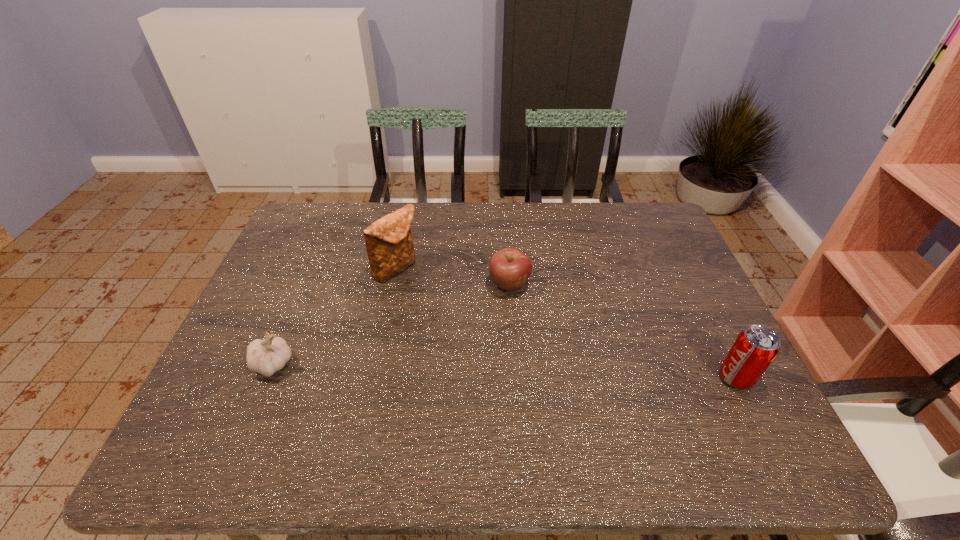
Locate an element on the screen. blank space located 0.220m on the side of the shortest object with the unique marking is located at coordinates (540, 362).

At what (x,y) coordinates should I click in order to perform the action: click on vacant space located 0.130m on the side of the shortest object with the unique marking. Please return your answer as a coordinate pair (x, y). This screenshot has width=960, height=540. Looking at the image, I should click on (529, 334).

Where is `vacant area situated 0.180m on the side of the shortest object with the unique marking`? vacant area situated 0.180m on the side of the shortest object with the unique marking is located at coordinates pyautogui.click(x=535, y=349).

This screenshot has height=540, width=960. Identify the location of vacant space located 0.050m on the open side of the clutch bag. (420, 291).

You are a GUI agent. You are given a task and a screenshot of the screen. Output one action in this format:
    pyautogui.click(x=<x>, y=<y>)
    Task: Click on the free space located 0.090m on the open side of the clutch bag
    Image resolution: width=960 pixels, height=540 pixels.
    Given the screenshot: What is the action you would take?
    pyautogui.click(x=429, y=298)

Identify the location of free region located on the open side of the clutch bag. The width and height of the screenshot is (960, 540). (474, 337).

You are a GUI agent. You are given a task and a screenshot of the screen. Output one action in this format:
    pyautogui.click(x=<x>, y=<y>)
    Task: Click on the object present at the near edge
    This screenshot has width=960, height=540.
    Given the screenshot: What is the action you would take?
    (754, 349)

This screenshot has height=540, width=960. What are the coordinates of `object present at the left edge` in the screenshot? It's located at (267, 356).

You are a GUI agent. You are given a task and a screenshot of the screen. Output one action in this format:
    pyautogui.click(x=<x>, y=<y>)
    Task: Click on the object at the right edge
    
    Given the screenshot: What is the action you would take?
    pyautogui.click(x=754, y=349)

Identify the location of object that is at the near right corner. The image size is (960, 540). (754, 349).